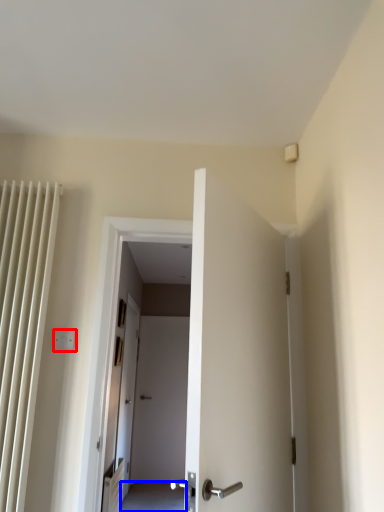
Question: Among these objects, which one is nearest to the camera, electric outlet (highlighted by a red box) or path (highlighted by a blue box)?

Choices:
 (A) electric outlet
 (B) path

Answer: (A)